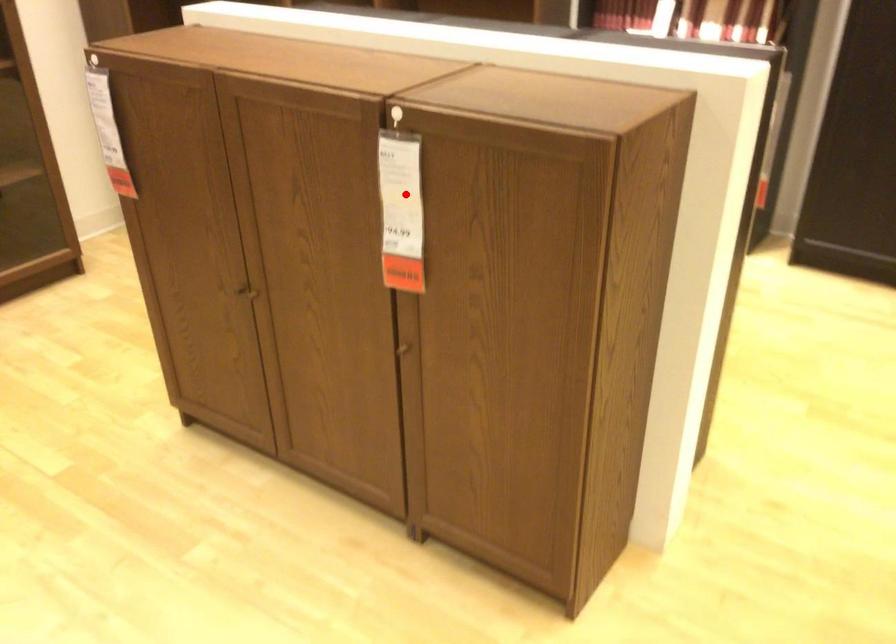
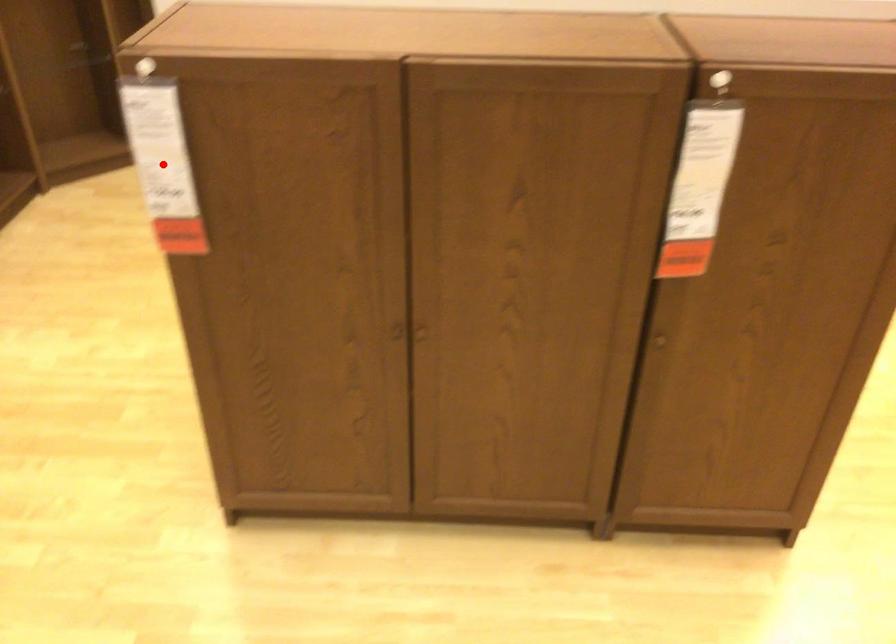
I am providing you with two images of the same scene from different viewpoints. A red point is marked on the first image and another point is marked on the second image. Does the point marked in image1 correspond to the same location as the one in image2?

No